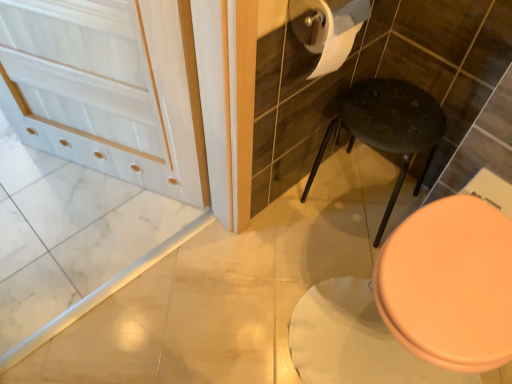
In order to click on white matte toilet paper at upper right in this screenshot , I will do `click(336, 32)`.

The image size is (512, 384). I want to click on dark speckled plastic stool at center, so click(x=388, y=127).

The image size is (512, 384). What are the coordinates of `white matte screen door at upper left` in the screenshot? It's located at (108, 88).

Is pink glossy toilet seat at lower right in front of or behind dark speckled plastic stool at center in the image?

Visually, pink glossy toilet seat at lower right is located in front of dark speckled plastic stool at center.

Between pink glossy toilet seat at lower right and dark speckled plastic stool at center, which one has smaller size?

With smaller size is dark speckled plastic stool at center.

Is pink glossy toilet seat at lower right wider than dark speckled plastic stool at center?

Yes.

Between pink glossy toilet seat at lower right and dark speckled plastic stool at center, which one appears on the left side from the viewer's perspective?

From the viewer's perspective, dark speckled plastic stool at center appears more on the left side.

Between white matte toilet paper at upper right and pink glossy toilet seat at lower right, which one is positioned behind?

white matte toilet paper at upper right is more distant.

Is white matte toilet paper at upper right completely or partially outside of pink glossy toilet seat at lower right?

Yes, white matte toilet paper at upper right is located beyond the bounds of pink glossy toilet seat at lower right.

Which is more to the right, white matte toilet paper at upper right or pink glossy toilet seat at lower right?

From the viewer's perspective, pink glossy toilet seat at lower right appears more on the right side.

Is white matte toilet paper at upper right aimed at pink glossy toilet seat at lower right?

No, white matte toilet paper at upper right is not facing towards pink glossy toilet seat at lower right.

Does white matte screen door at upper left turn towards pink glossy toilet seat at lower right?

No, white matte screen door at upper left is not aimed at pink glossy toilet seat at lower right.

Considering the sizes of objects white matte screen door at upper left and pink glossy toilet seat at lower right in the image provided, who is thinner, white matte screen door at upper left or pink glossy toilet seat at lower right?

white matte screen door at upper left.

Could you measure the distance between white matte screen door at upper left and pink glossy toilet seat at lower right?

The distance of white matte screen door at upper left from pink glossy toilet seat at lower right is 32.92 inches.

Can you tell me how much white matte screen door at upper left and pink glossy toilet seat at lower right differ in facing direction?

There is a 23.3-degree angle between the facing directions of white matte screen door at upper left and pink glossy toilet seat at lower right.

From a real-world perspective, between dark speckled plastic stool at center and white matte screen door at upper left, who is vertically higher?

In real-world perspective, white matte screen door at upper left is above.

Considering the positions of objects dark speckled plastic stool at center and white matte screen door at upper left in the image provided, who is in front, dark speckled plastic stool at center or white matte screen door at upper left?

Positioned in front is white matte screen door at upper left.

From the image's perspective, is dark speckled plastic stool at center located above or below white matte screen door at upper left?

From the image's perspective, dark speckled plastic stool at center appears below white matte screen door at upper left.

Can you confirm if dark speckled plastic stool at center is smaller than white matte screen door at upper left?

Correct, dark speckled plastic stool at center occupies less space than white matte screen door at upper left.

Considering the sizes of pink glossy toilet seat at lower right and white matte screen door at upper left in the image, is pink glossy toilet seat at lower right wider or thinner than white matte screen door at upper left?

In the image, pink glossy toilet seat at lower right appears to be wider than white matte screen door at upper left.

Is pink glossy toilet seat at lower right inside or outside of white matte screen door at upper left?

pink glossy toilet seat at lower right lies outside white matte screen door at upper left.

Is pink glossy toilet seat at lower right situated inside white matte toilet paper at upper right or outside?

pink glossy toilet seat at lower right is spatially situated outside white matte toilet paper at upper right.

Considering the relative positions of pink glossy toilet seat at lower right and white matte toilet paper at upper right in the image provided, is pink glossy toilet seat at lower right to the left or to the right of white matte toilet paper at upper right?

Clearly, pink glossy toilet seat at lower right is on the right of white matte toilet paper at upper right in the image.

Locate an element on the screen. The image size is (512, 384). toilet paper above the pink glossy toilet seat at lower right (from the image's perspective) is located at coordinates (336, 32).

In the scene shown: Which of these two, dark speckled plastic stool at center or pink glossy toilet seat at lower right, is thinner?

dark speckled plastic stool at center.

Is dark speckled plastic stool at center not inside pink glossy toilet seat at lower right?

Indeed, dark speckled plastic stool at center is completely outside pink glossy toilet seat at lower right.

Is point (402, 83) positioned behind point (414, 327)?

That is True.

Locate an element on the screen. Image resolution: width=512 pixels, height=384 pixels. bar stool that appears above the pink glossy toilet seat at lower right (from the image's perspective) is located at coordinates (388, 127).

At what (x,y) coordinates should I click in order to perform the action: click on toilet on the right of white matte toilet paper at upper right. Please return your answer as a coordinate pair (x, y). Looking at the image, I should click on (449, 284).

Looking at the image, which one is located closer to white matte toilet paper at upper right, white matte screen door at upper left or dark speckled plastic stool at center?

dark speckled plastic stool at center.

Looking at the image, which one is located further to white matte toilet paper at upper right, pink glossy toilet seat at lower right or dark speckled plastic stool at center?

pink glossy toilet seat at lower right lies further to white matte toilet paper at upper right than the other object.

Based on their spatial positions, is white matte toilet paper at upper right or white matte screen door at upper left further from dark speckled plastic stool at center?

Based on the image, white matte screen door at upper left appears to be further to dark speckled plastic stool at center.

Which object lies nearer to the anchor point white matte toilet paper at upper right, dark speckled plastic stool at center or white matte screen door at upper left?

dark speckled plastic stool at center.

Looking at this image, looking at the image, which one is located further to dark speckled plastic stool at center, white matte screen door at upper left or pink glossy toilet seat at lower right?

white matte screen door at upper left.

Which object lies nearer to the anchor point pink glossy toilet seat at lower right, white matte toilet paper at upper right or white matte screen door at upper left?

The object closer to pink glossy toilet seat at lower right is white matte toilet paper at upper right.

When comparing their distances from white matte screen door at upper left, does pink glossy toilet seat at lower right or dark speckled plastic stool at center seem closer?

dark speckled plastic stool at center.

Looking at this image, when comparing their distances from white matte toilet paper at upper right, does pink glossy toilet seat at lower right or white matte screen door at upper left seem further?

white matte screen door at upper left is further to white matte toilet paper at upper right.

Where is `bar stool between white matte toilet paper at upper right and pink glossy toilet seat at lower right in the up-down direction`? The width and height of the screenshot is (512, 384). bar stool between white matte toilet paper at upper right and pink glossy toilet seat at lower right in the up-down direction is located at coordinates (388, 127).

Locate an element on the screen. bar stool between white matte screen door at upper left and pink glossy toilet seat at lower right is located at coordinates (388, 127).

Locate an element on the screen. toilet paper located between white matte screen door at upper left and dark speckled plastic stool at center in the left-right direction is located at coordinates (336, 32).

This screenshot has width=512, height=384. I want to click on toilet paper between white matte screen door at upper left and pink glossy toilet seat at lower right from left to right, so click(x=336, y=32).